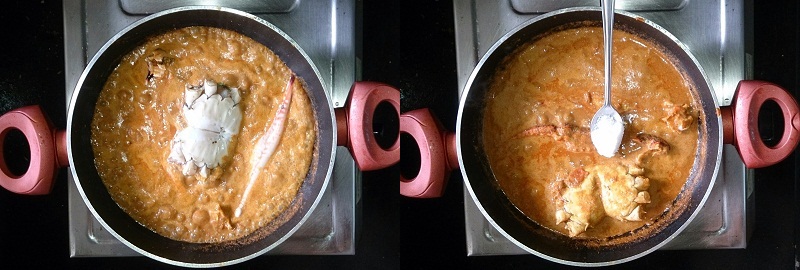
This screenshot has width=800, height=270. I want to click on spoon, so click(x=605, y=33).